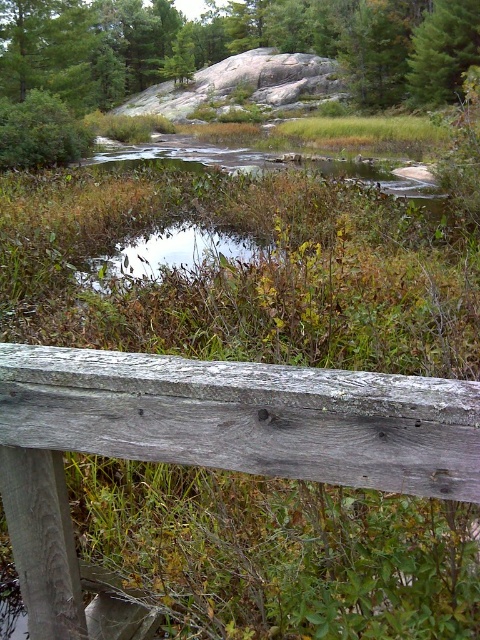
Question: Does weathered wood rail at center have a smaller size compared to green matte tree at upper right?

Choices:
 (A) no
 (B) yes

Answer: (B)

Question: Which of the following is the farthest from the observer?

Choices:
 (A) weathered wood rail at center
 (B) green grassy puddle at center
 (C) green textured rock at upper center
 (D) green matte tree at upper right

Answer: (D)

Question: Among these objects, which one is nearest to the camera?

Choices:
 (A) green grassy puddle at center
 (B) green textured rock at upper center
 (C) weathered wood rail at center
 (D) green matte tree at upper right

Answer: (C)

Question: Does green textured rock at upper center have a lesser width compared to green matte tree at upper right?

Choices:
 (A) yes
 (B) no

Answer: (B)

Question: Considering the relative positions of weathered wood rail at center and green textured rock at upper center in the image provided, where is weathered wood rail at center located with respect to green textured rock at upper center?

Choices:
 (A) left
 (B) right

Answer: (B)

Question: Among these objects, which one is farthest from the camera?

Choices:
 (A) weathered wood rail at center
 (B) green matte tree at upper right
 (C) green textured rock at upper center
 (D) green grassy puddle at center

Answer: (B)